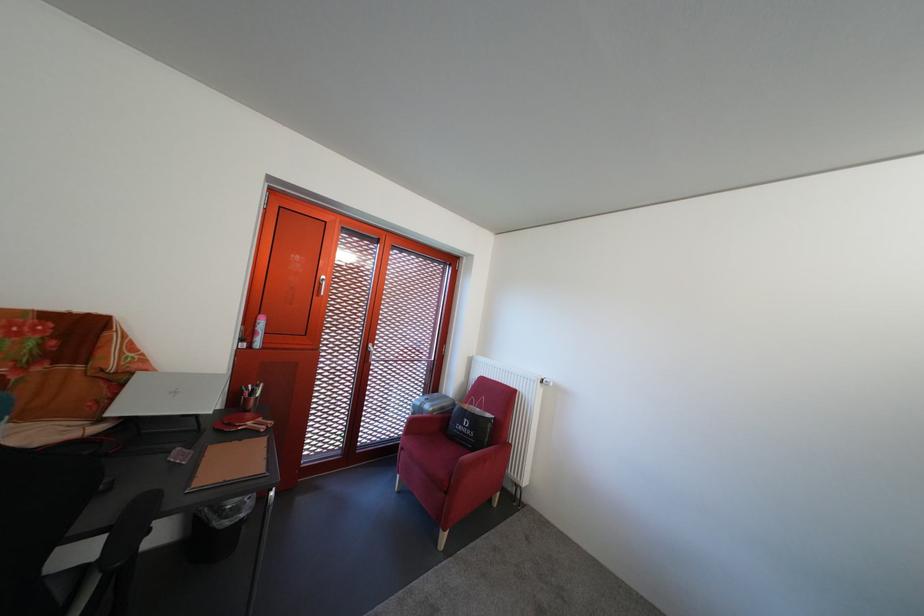
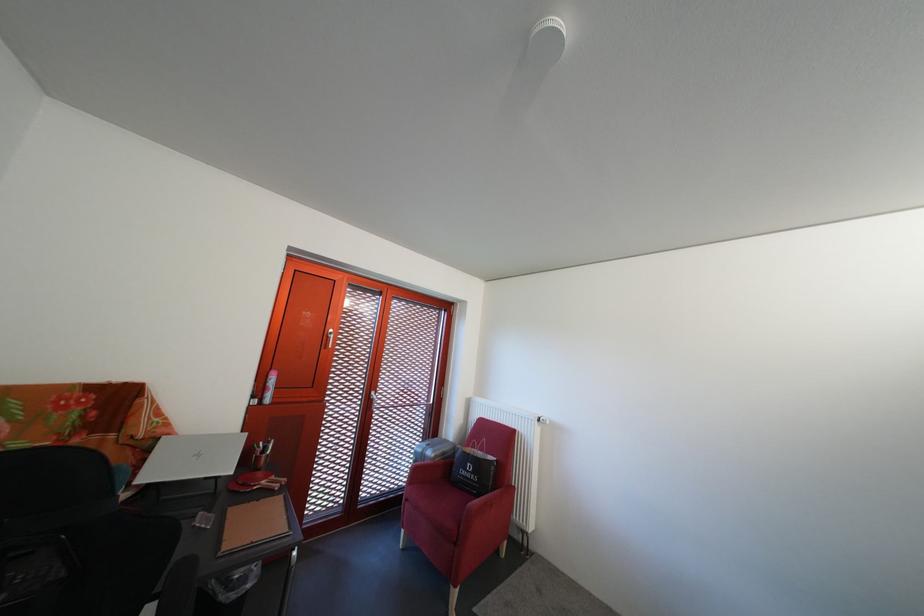
Question: Based on the continuous images, in which direction is the camera rotating? Reply with the corresponding letter.

Choices:
 (A) Left
 (B) Right
 (C) Up
 (D) Down

Answer: (C)